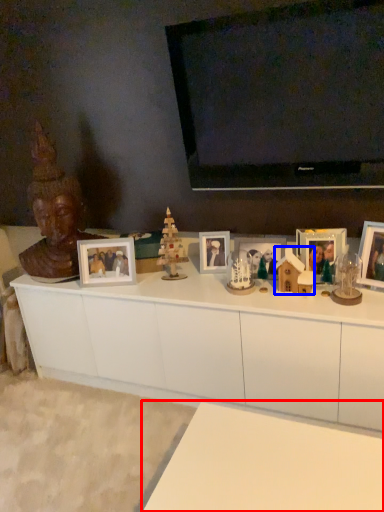
Question: Which of the following is the farthest to the observer, table (highlighted by a red box) or toy (highlighted by a blue box)?

Choices:
 (A) table
 (B) toy

Answer: (B)